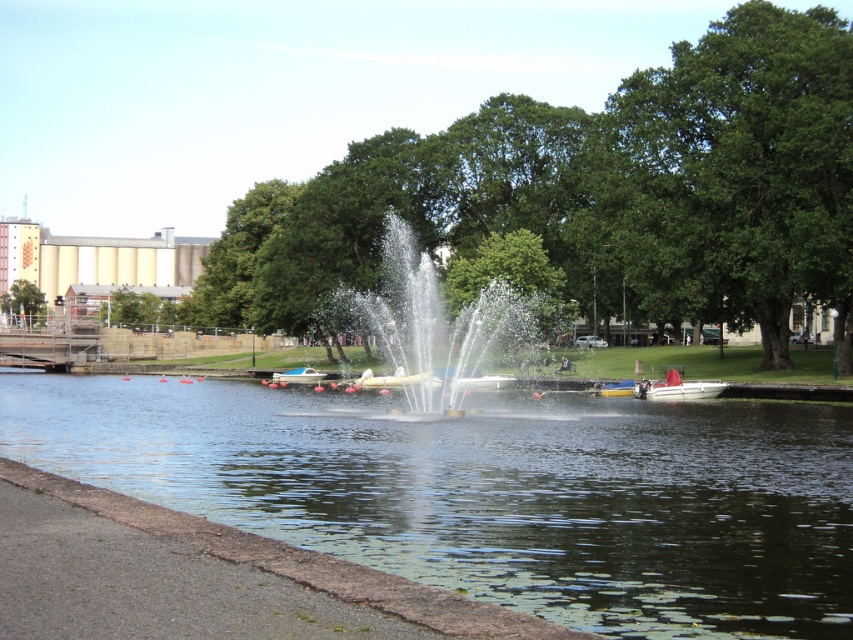
You are planning to take a photo of the green leafy tree at upper left and the white plastic boat at center from the pathway. Which object will appear wider in the photo?

The green leafy tree at upper left will appear wider in the photo because its width is larger than the white plastic boat at center.

You are standing at the white plastic boat at center in the park. You want to walk to the green leafy tree at upper left. The path you need to take is along the paved pathway that runs parallel to the water. How far will you have to walk approximately in feet?

The green leafy tree at upper left is 202.04 feet from the white plastic boat at center, so you will have to walk approximately 202.04 feet along the paved pathway to reach it.